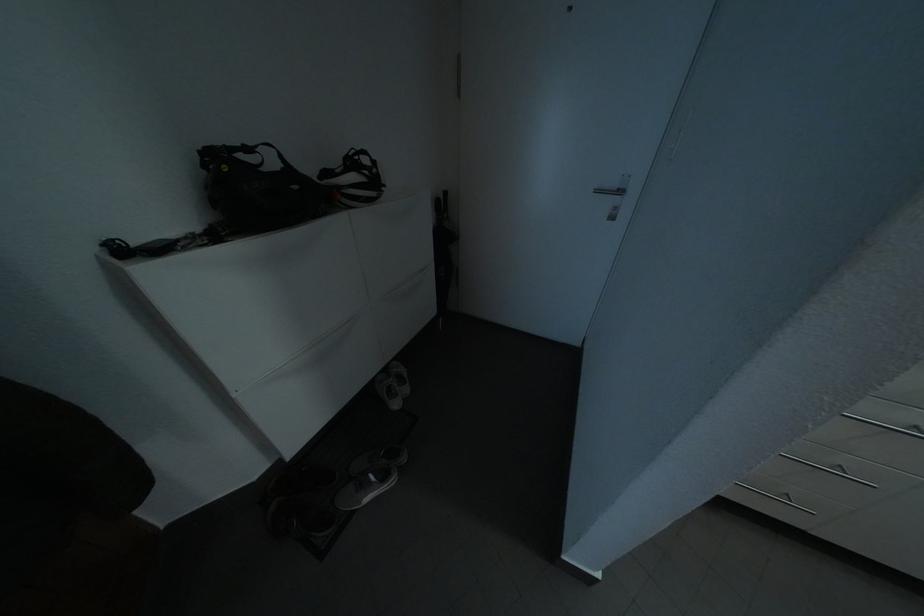
Describe the element at coordinates (359, 185) in the screenshot. I see `the bicycle helmet` at that location.